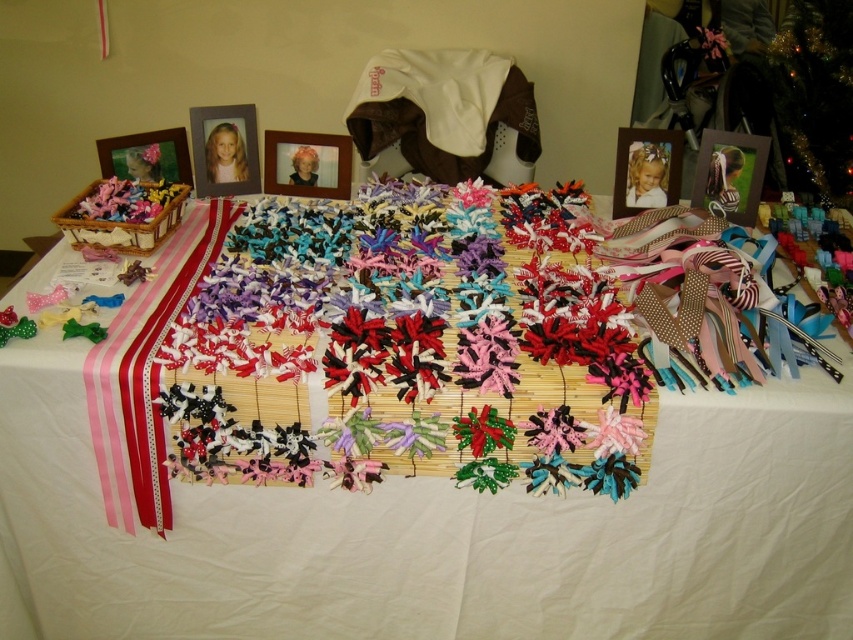
Does matte wooden picture frame at upper left come in front of blonde hair doll at center?

That is True.

Does matte wooden picture frame at upper left lie behind blonde hair doll at center?

No.

This screenshot has width=853, height=640. Describe the element at coordinates (146, 156) in the screenshot. I see `matte wooden picture frame at upper left` at that location.

The width and height of the screenshot is (853, 640). Find the location of `matte wooden picture frame at upper left`. matte wooden picture frame at upper left is located at coordinates (146, 156).

Is point (724, 164) positioned before point (154, 166)?

Yes.

Is wooden photo frame at upper right above matte wooden picture frame at upper left?

No, wooden photo frame at upper right is not above matte wooden picture frame at upper left.

You are a GUI agent. You are given a task and a screenshot of the screen. Output one action in this format:
    pyautogui.click(x=<x>, y=<y>)
    Task: Click on the wooden photo frame at upper right
    This screenshot has width=853, height=640.
    Given the screenshot: What is the action you would take?
    pyautogui.click(x=730, y=173)

The width and height of the screenshot is (853, 640). Identify the location of wooden photo frame at upper right. (730, 173).

Can you confirm if white fabric at center is positioned to the left of blonde hair doll at center?

Incorrect, white fabric at center is not on the left side of blonde hair doll at center.

Identify the location of white fabric at center. (466, 534).

At what (x,y) coordinates should I click in order to perform the action: click on white fabric at center. Please return your answer as a coordinate pair (x, y). The image size is (853, 640). Looking at the image, I should click on (466, 534).